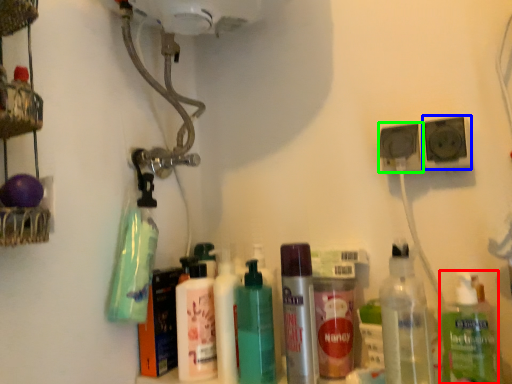
Question: Which object is positioned farthest from bottle (highlighted by a red box)? Select from speaker (highlighted by a blue box) and speaker (highlighted by a green box).

Choices:
 (A) speaker
 (B) speaker

Answer: (B)